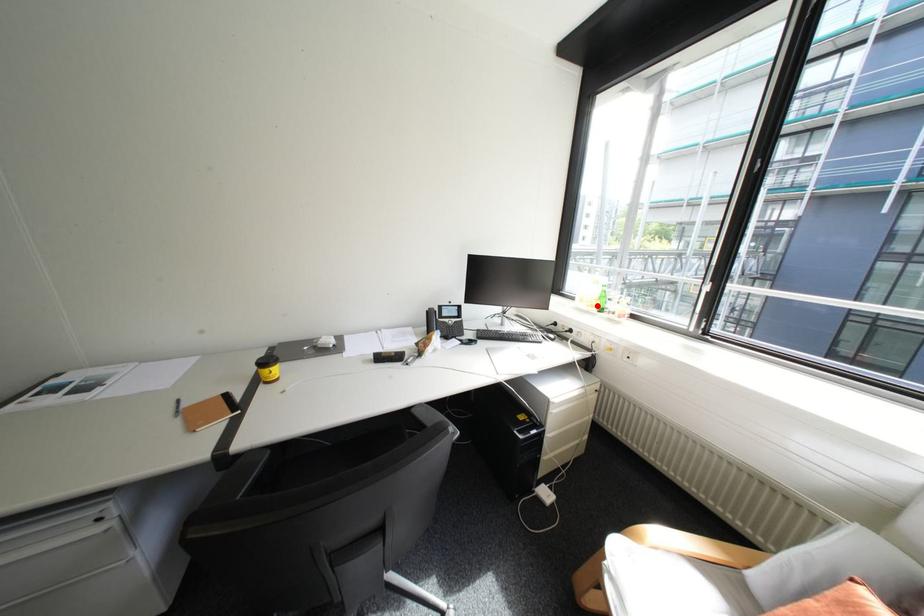
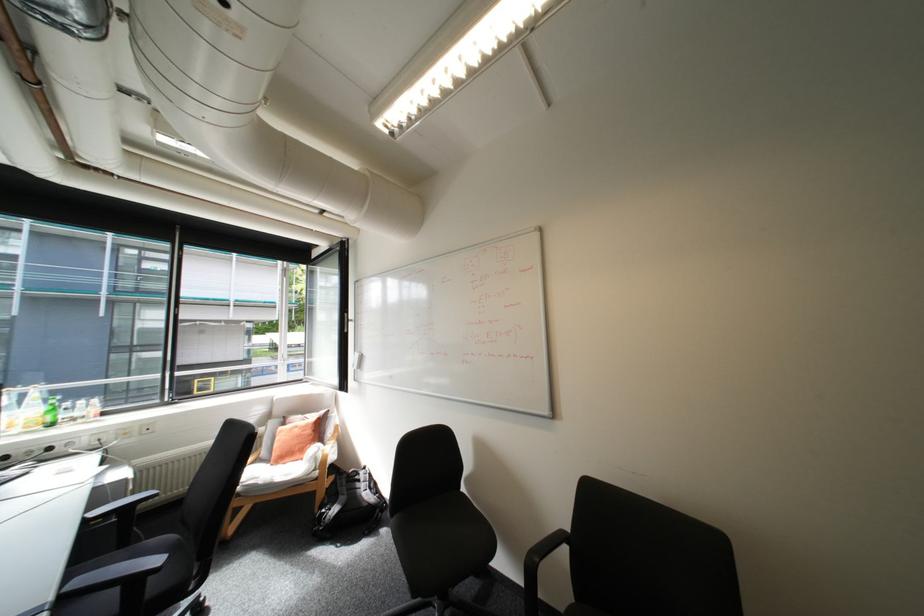
Where in the second image is the point corresponding to the highlighted location from the first image?

(38, 427)